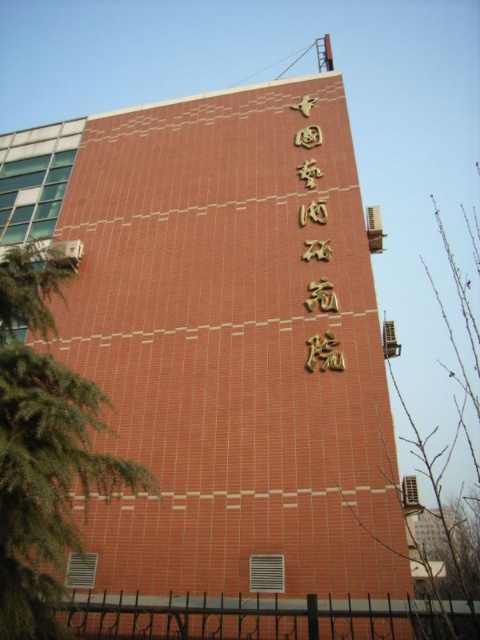
Who is shorter, green leafy tree at left or green leafy tree at center?

green leafy tree at left is shorter.

Identify the location of green leafy tree at left. (44, 448).

Between point (1, 630) and point (471, 401), which one is positioned behind?

Positioned behind is point (471, 401).

You are a GUI agent. You are given a task and a screenshot of the screen. Output one action in this format:
    pyautogui.click(x=<x>, y=<y>)
    Task: Click on the green leafy tree at left
    The width and height of the screenshot is (480, 640).
    Given the screenshot: What is the action you would take?
    pyautogui.click(x=44, y=448)

Which is behind, point (83, 476) or point (302, 145)?

The point (302, 145) is behind.

Can you confirm if green leafy tree at left is bigger than gold metallic sign at upper center?

Correct, green leafy tree at left is larger in size than gold metallic sign at upper center.

Is point (34, 429) less distant than point (332, 352)?

Yes, point (34, 429) is closer to viewer.

At what (x,y) coordinates should I click in order to perform the action: click on green leafy tree at left. Please return your answer as a coordinate pair (x, y). This screenshot has width=480, height=640. Looking at the image, I should click on (44, 448).

Does green leafy tree at center appear on the left side of gold metallic sign at upper center?

No, green leafy tree at center is not to the left of gold metallic sign at upper center.

Does point (458, 563) come in front of point (321, 220)?

That is False.

This screenshot has width=480, height=640. I want to click on green leafy tree at center, so click(x=446, y=532).